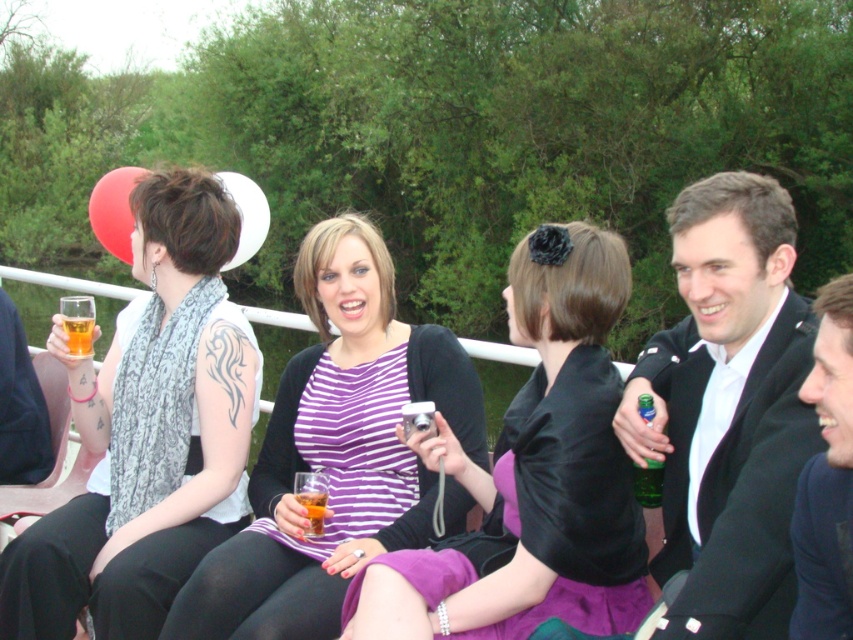
You are a photographer at the event and want to capture both the striped fabric dress at center and the navy blue suit at right in a single frame. Based on their positions, which direction should you move to ensure both are visible?

Since the striped fabric dress at center is to the left of the navy blue suit at right, you should move to the right to ensure both the striped fabric dress at center and the navy blue suit at right are visible in your frame.

In the scene shown: You are at a party by the water and want to grab a drink quickly. You see two translucent glasses, the translucent glass beverage at center and the translucent glass at upper left. Which one is easier to reach without moving your position?

The translucent glass beverage at center is easier to reach because it is closer to the viewer than the translucent glass at upper left.